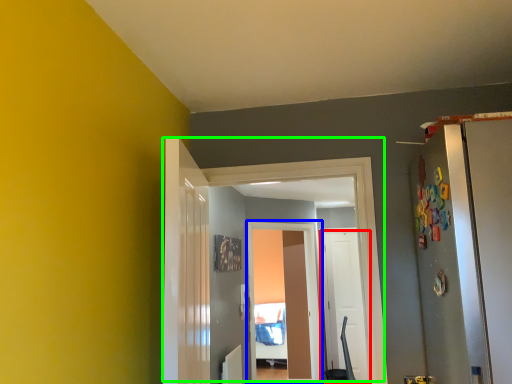
Question: Which object is the farthest from door (highlighted by a red box)? Choose among these: screen door (highlighted by a blue box) or door (highlighted by a green box).

Choices:
 (A) screen door
 (B) door

Answer: (B)